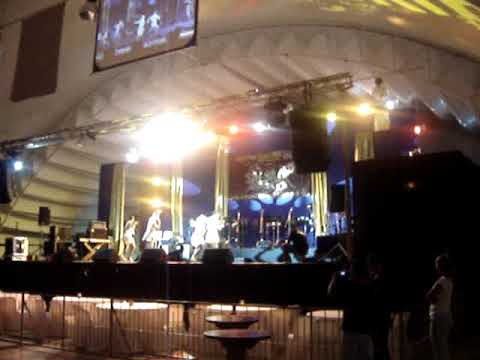
Where is `stage`? stage is located at coordinates (254, 260), (125, 277), (123, 258), (78, 258), (249, 243).